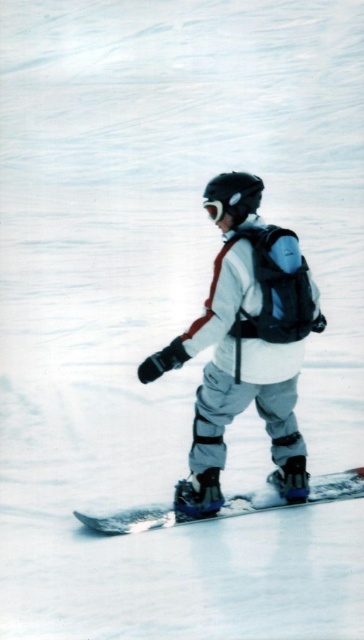
You are a photographer trying to capture the white matte snowboarder at center in the image. The camera you are using has a focal point at coordinates 0.5, 0.5. Will the snowboarder be in focus?

The white matte snowboarder at center is located at point (247,356), which is slightly off the camera focal point at (182,320). Therefore, the snowboarder may not be perfectly in focus unless the camera adjusts its focus point.

You are a photographer trying to capture a clear shot of the white matte snowboarder at center and the white matte goggles at center. Based on their positions, which object should you focus on first to ensure both are in the frame?

The white matte snowboarder at center is located below the white matte goggles at center, so you should focus on the white matte goggles at center first to ensure both are in the frame.

Looking at this image, you are a photographer trying to capture the snowboarder. You notice the white matte snowboarder at center and the white plastic snowboard at center. Which object is positioned higher in the image?

The white matte snowboarder at center is above the white plastic snowboard at center, so the white matte snowboarder at center is positioned higher in the image.